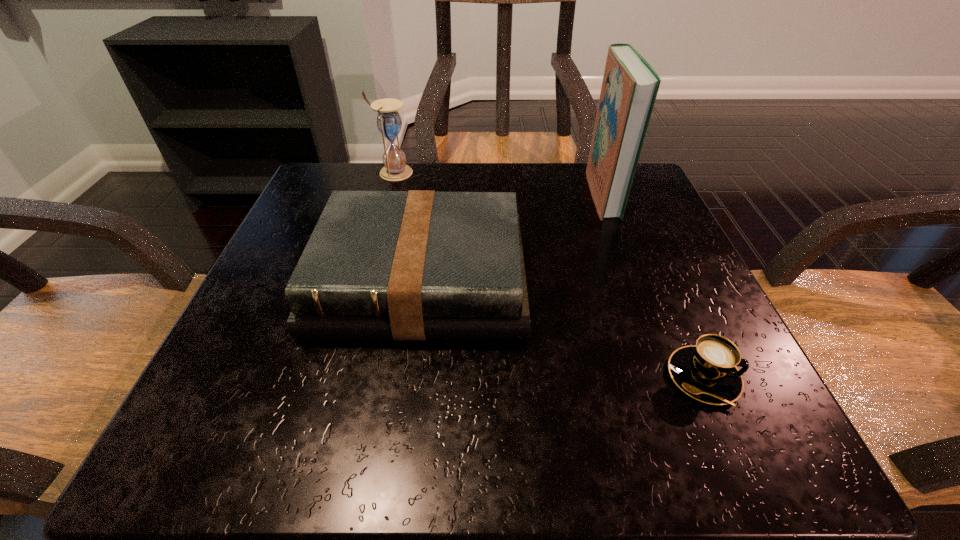
Identify the location of free space between the cappuccino and the hourglass. (548, 275).

I want to click on empty location between the farther hardback book and the second tallest object, so click(498, 183).

Find the location of a particular element. Image resolution: width=960 pixels, height=540 pixels. free space between the left hardback book and the cappuccino is located at coordinates (562, 328).

Locate an element on the screen. Image resolution: width=960 pixels, height=540 pixels. empty space that is in between the cappuccino and the hourglass is located at coordinates (548, 275).

Locate an element on the screen. The width and height of the screenshot is (960, 540). vacant area that lies between the second tallest object and the cappuccino is located at coordinates (548, 275).

Where is `empty space that is in between the farther hardback book and the second tallest object`? empty space that is in between the farther hardback book and the second tallest object is located at coordinates (498, 183).

You are a GUI agent. You are given a task and a screenshot of the screen. Output one action in this format:
    pyautogui.click(x=<x>, y=<y>)
    Task: Click on the free spot between the hourglass and the taller hardback book
    
    Given the screenshot: What is the action you would take?
    pos(498,183)

Find the location of `blank region between the nearest object and the shorter hardback book`. blank region between the nearest object and the shorter hardback book is located at coordinates (562, 328).

This screenshot has width=960, height=540. Identify the location of free space between the right hardback book and the nearest object. (653, 286).

Locate an element on the screen. This screenshot has height=540, width=960. object that is the third closest to the farther hardback book is located at coordinates (389, 123).